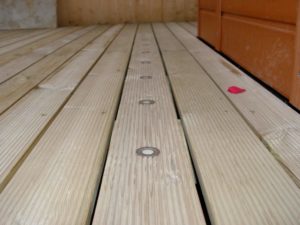
Where is `dots on the floor`? The image size is (300, 225). dots on the floor is located at coordinates (150, 151), (145, 104), (147, 81), (148, 64), (145, 54), (145, 43), (145, 38).